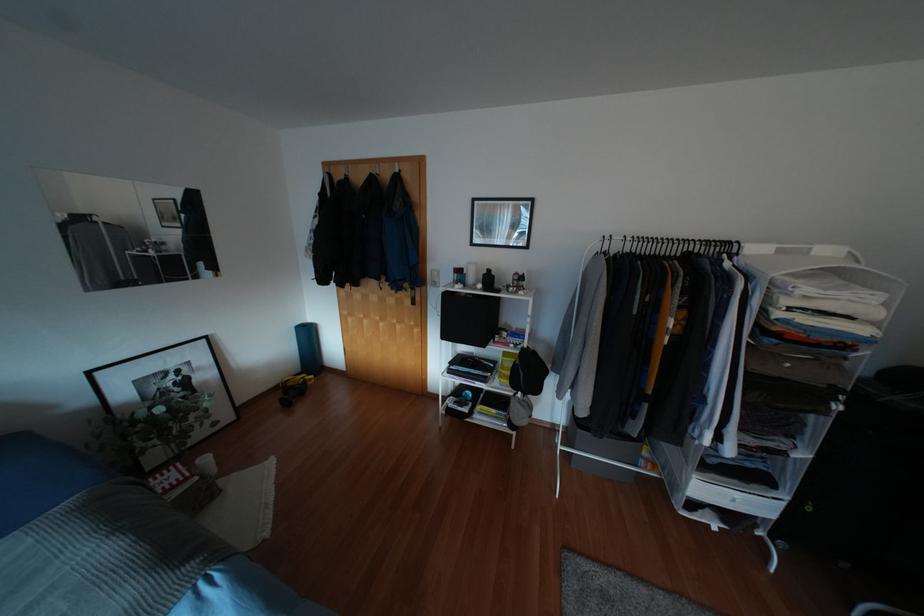
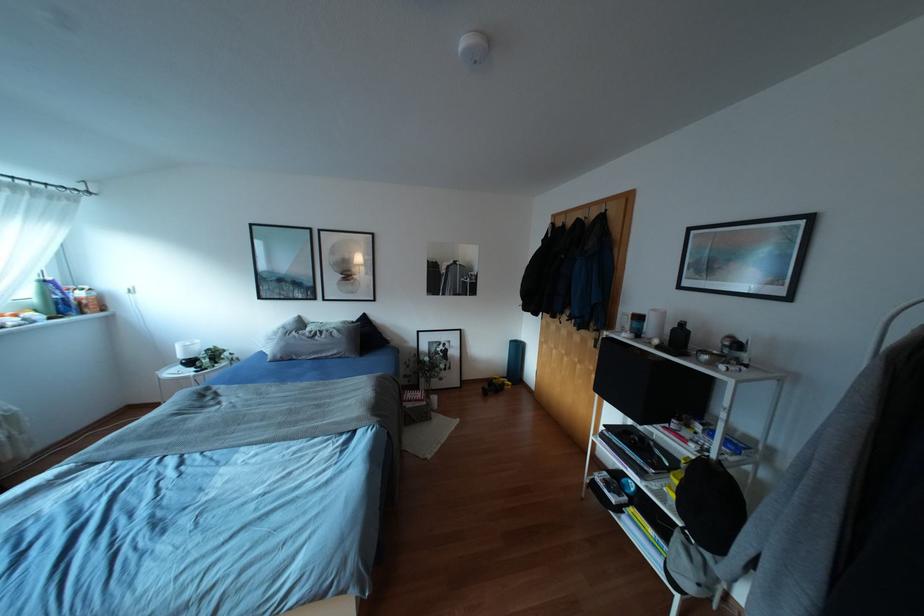
Locate, in the second image, the point that corresponds to pixel 406 176 in the first image.

(612, 214)